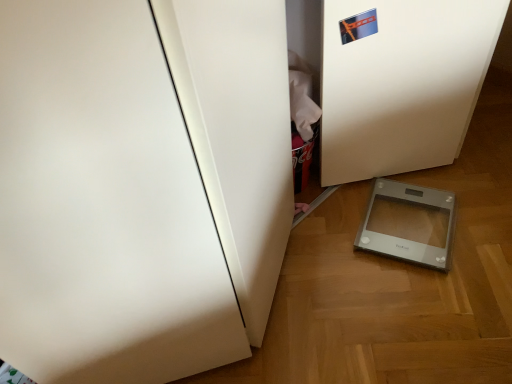
This screenshot has width=512, height=384. What are the coordinates of `free space in front of transparent plastic scale at lower right` in the screenshot? It's located at (433, 301).